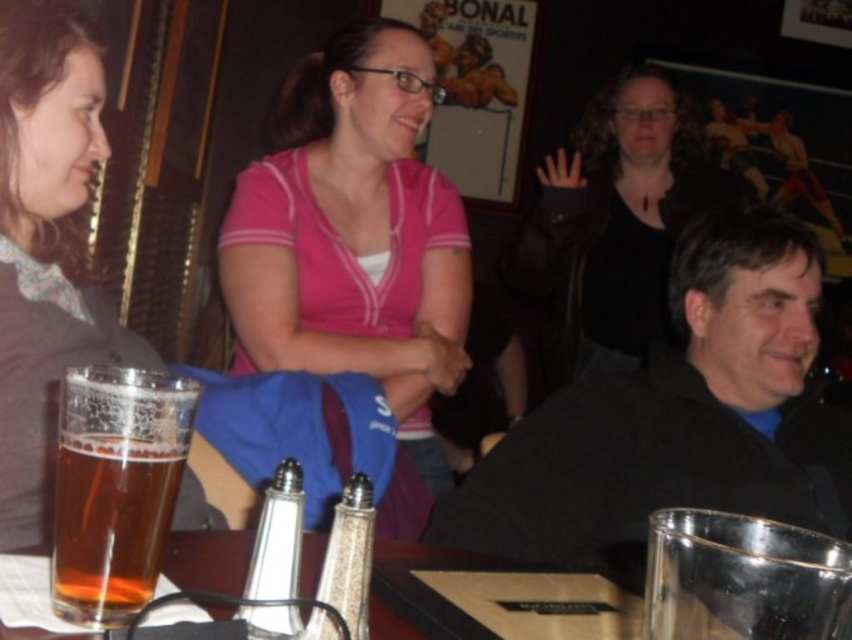
Question: Which point is closer to the camera taking this photo?

Choices:
 (A) (68, 588)
 (B) (398, 433)

Answer: (A)

Question: Can you confirm if pink jersey at center is positioned below matte gray sweater at left?

Choices:
 (A) yes
 (B) no

Answer: (B)

Question: Considering the relative positions of matte gray sweater at left and matte black jacket at upper center in the image provided, where is matte gray sweater at left located with respect to matte black jacket at upper center?

Choices:
 (A) right
 (B) left

Answer: (B)

Question: Which point is closer to the camera taking this photo?

Choices:
 (A) (347, 512)
 (B) (273, 262)

Answer: (A)

Question: Can you confirm if pink jersey at center is smaller than translucent glass bottle at center?

Choices:
 (A) yes
 (B) no

Answer: (B)

Question: Considering the real-world distances, which object is farthest from the pink jersey at center?

Choices:
 (A) black matte jacket at center
 (B) matte black jacket at upper center
 (C) matte gray sweater at left
 (D) translucent glass bottle at center

Answer: (D)